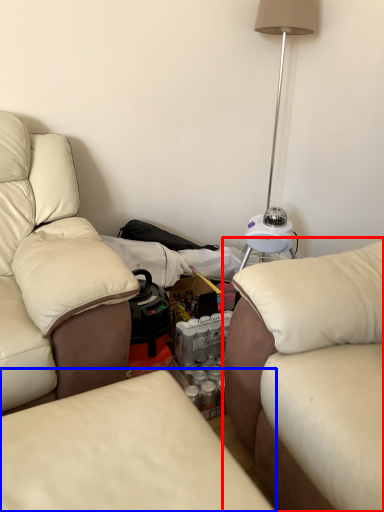
Question: Which of the following is the closest to the observer, studio couch (highlighted by a red box) or studio couch (highlighted by a blue box)?

Choices:
 (A) studio couch
 (B) studio couch

Answer: (B)